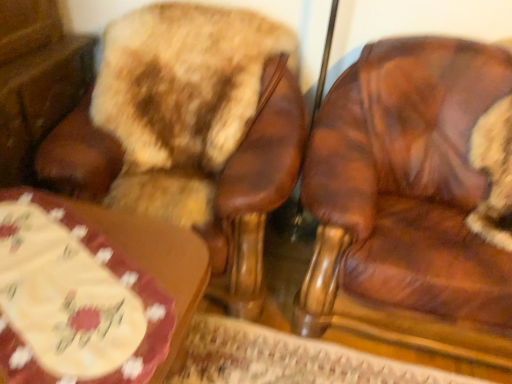
The width and height of the screenshot is (512, 384). Describe the element at coordinates (91, 291) in the screenshot. I see `wooden table at lower left` at that location.

This screenshot has width=512, height=384. What do you see at coordinates (190, 129) in the screenshot?
I see `brown leather chair at upper left, the second chair viewed from the right` at bounding box center [190, 129].

Find the location of a particular element. wooden table at lower left is located at coordinates (91, 291).

Is wooden table at lower left at the left side of brown leather chair at upper left, the second chair viewed from the right?

Yes.

From a real-world perspective, is wooden table at lower left physically above brown leather chair at upper left, placed as the first chair when sorted from left to right?

No, from a real-world perspective, wooden table at lower left is not over brown leather chair at upper left, placed as the first chair when sorted from left to right

Is the depth of wooden table at lower left less than that of brown leather chair at upper left, placed as the first chair when sorted from left to right?

That is True.

This screenshot has width=512, height=384. What are the coordinates of `table lying on the left of brown leather chair at upper left, placed as the first chair when sorted from left to right` in the screenshot? It's located at (91, 291).

Is wooden table at lower left at the back of brown leather chair at right, which appears as the 1th chair when viewed from the right?

No, brown leather chair at right, which appears as the 1th chair when viewed from the right, is not facing the opposite direction of wooden table at lower left.

Considering the positions of objects brown leather chair at right, which appears as the 1th chair when viewed from the right, and wooden table at lower left in the image provided, who is more to the left, brown leather chair at right, which appears as the 1th chair when viewed from the right, or wooden table at lower left?

wooden table at lower left.

How many degrees apart are the facing directions of brown leather chair at right, which appears as the 1th chair when viewed from the right, and wooden table at lower left?

There is a 0.669-degree angle between the facing directions of brown leather chair at right, which appears as the 1th chair when viewed from the right, and wooden table at lower left.

Based on the photo, does brown leather chair at right, which appears as the 1th chair when viewed from the right, come behind brown leather chair at upper left, placed as the first chair when sorted from left to right?

No, brown leather chair at right, which appears as the 1th chair when viewed from the right, is closer to the viewer.

Considering the relative positions of brown leather chair at right, marked as the 2th chair in a left-to-right arrangement, and brown leather chair at upper left, placed as the first chair when sorted from left to right, in the image provided, is brown leather chair at right, marked as the 2th chair in a left-to-right arrangement, to the left of brown leather chair at upper left, placed as the first chair when sorted from left to right, from the viewer's perspective?

No.

I want to click on chair that is above the brown leather chair at right, which appears as the 1th chair when viewed from the right (from the image's perspective), so click(x=190, y=129).

From the image's perspective, does brown leather chair at right, marked as the 2th chair in a left-to-right arrangement, appear higher than brown leather chair at upper left, the second chair viewed from the right?

No, from the image's perspective, brown leather chair at right, marked as the 2th chair in a left-to-right arrangement, is not above brown leather chair at upper left, the second chair viewed from the right.

Is brown leather chair at upper left, the second chair viewed from the right, outside of wooden table at lower left?

Absolutely, brown leather chair at upper left, the second chair viewed from the right, is external to wooden table at lower left.

From a real-world perspective, is brown leather chair at upper left, placed as the first chair when sorted from left to right, positioned above or below wooden table at lower left?

In terms of real-world spatial position, brown leather chair at upper left, placed as the first chair when sorted from left to right, is above wooden table at lower left.

Is brown leather chair at upper left, placed as the first chair when sorted from left to right, far away from wooden table at lower left?

No, there isn't a large distance between brown leather chair at upper left, placed as the first chair when sorted from left to right, and wooden table at lower left.

Is point (131, 134) closer or farther from the camera than point (142, 222)?

Point (131, 134).

Consider the image. Is brown leather chair at right, which appears as the 1th chair when viewed from the right, located within brown leather chair at upper left, the second chair viewed from the right?

No, brown leather chair at right, which appears as the 1th chair when viewed from the right, is not surrounded by brown leather chair at upper left, the second chair viewed from the right.

Can you tell me how much brown leather chair at upper left, the second chair viewed from the right, and brown leather chair at right, marked as the 2th chair in a left-to-right arrangement, differ in facing direction?

0.000149 degrees.

Which object is closer to the camera, brown leather chair at upper left, placed as the first chair when sorted from left to right, or brown leather chair at right, marked as the 2th chair in a left-to-right arrangement?

brown leather chair at right, marked as the 2th chair in a left-to-right arrangement, is closer to the camera.

Can you confirm if wooden table at lower left is thinner than brown leather chair at right, which appears as the 1th chair when viewed from the right?

Indeed, wooden table at lower left has a lesser width compared to brown leather chair at right, which appears as the 1th chair when viewed from the right.

Considering the positions of objects wooden table at lower left and brown leather chair at right, marked as the 2th chair in a left-to-right arrangement, in the image provided, who is more to the left, wooden table at lower left or brown leather chair at right, marked as the 2th chair in a left-to-right arrangement,?

From the viewer's perspective, wooden table at lower left appears more on the left side.

Can you confirm if wooden table at lower left is smaller than brown leather chair at right, which appears as the 1th chair when viewed from the right?

Yes.

Considering their positions, is wooden table at lower left located in front of or behind brown leather chair at right, which appears as the 1th chair when viewed from the right?

wooden table at lower left is positioned closer to the viewer than brown leather chair at right, which appears as the 1th chair when viewed from the right.

This screenshot has width=512, height=384. Identify the location of table below the brown leather chair at upper left, placed as the first chair when sorted from left to right (from the image's perspective). (91, 291).

This screenshot has width=512, height=384. What are the coordinates of `the 1st chair behind the wooden table at lower left, counting from the anchor's position` in the screenshot? It's located at (414, 195).

When comparing their distances from brown leather chair at upper left, placed as the first chair when sorted from left to right, does brown leather chair at right, marked as the 2th chair in a left-to-right arrangement, or wooden table at lower left seem closer?

wooden table at lower left is closer to brown leather chair at upper left, placed as the first chair when sorted from left to right.

Looking at this image, when comparing their distances from brown leather chair at upper left, placed as the first chair when sorted from left to right, does wooden table at lower left or brown leather chair at right, which appears as the 1th chair when viewed from the right, seem further?

Based on the image, brown leather chair at right, which appears as the 1th chair when viewed from the right, appears to be further to brown leather chair at upper left, placed as the first chair when sorted from left to right.

Which object lies further to the anchor point wooden table at lower left, brown leather chair at right, marked as the 2th chair in a left-to-right arrangement, or brown leather chair at upper left, the second chair viewed from the right?

The object further to wooden table at lower left is brown leather chair at right, marked as the 2th chair in a left-to-right arrangement.

Consider the image. Which object lies nearer to the anchor point brown leather chair at right, which appears as the 1th chair when viewed from the right, wooden table at lower left or brown leather chair at upper left, the second chair viewed from the right?

brown leather chair at upper left, the second chair viewed from the right, lies closer to brown leather chair at right, which appears as the 1th chair when viewed from the right, than the other object.

When comparing their distances from brown leather chair at right, which appears as the 1th chair when viewed from the right, does brown leather chair at upper left, placed as the first chair when sorted from left to right, or wooden table at lower left seem closer?

brown leather chair at upper left, placed as the first chair when sorted from left to right, is positioned closer to the anchor brown leather chair at right, which appears as the 1th chair when viewed from the right.

Which object lies further to the anchor point wooden table at lower left, brown leather chair at upper left, the second chair viewed from the right, or brown leather chair at right, marked as the 2th chair in a left-to-right arrangement?

brown leather chair at right, marked as the 2th chair in a left-to-right arrangement, is further to wooden table at lower left.

Where is `chair situated between wooden table at lower left and brown leather chair at right, which appears as the 1th chair when viewed from the right, from left to right`? This screenshot has width=512, height=384. chair situated between wooden table at lower left and brown leather chair at right, which appears as the 1th chair when viewed from the right, from left to right is located at coordinates (190, 129).